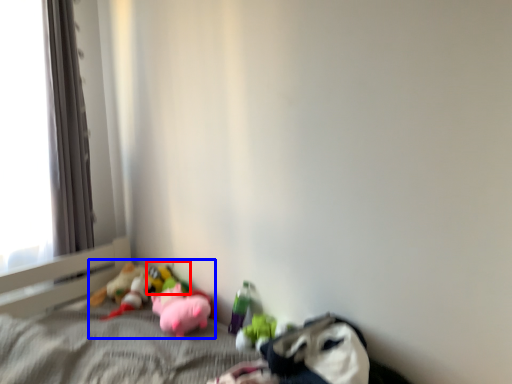
Question: Which of the following is the closest to the observer, toy (highlighted by a red box) or stuff (highlighted by a blue box)?

Choices:
 (A) toy
 (B) stuff

Answer: (B)